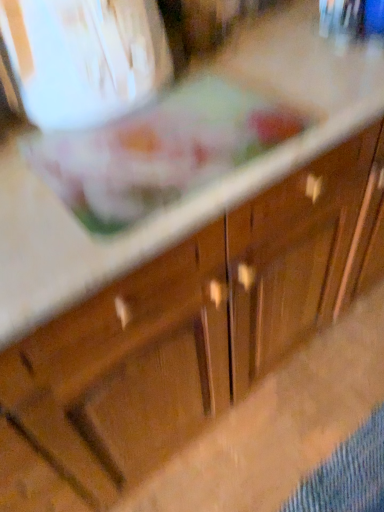
Locate an element on the screen. free location above clear plastic tray at upper center (from a real-world perspective) is located at coordinates (160, 143).